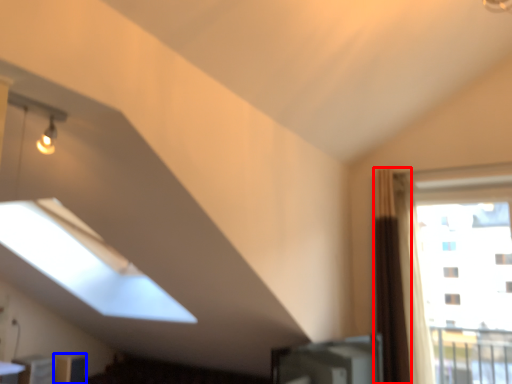
Question: Which object appears farthest to the camera in this image, curtain (highlighted by a red box) or furniture (highlighted by a blue box)?

Choices:
 (A) curtain
 (B) furniture

Answer: (B)